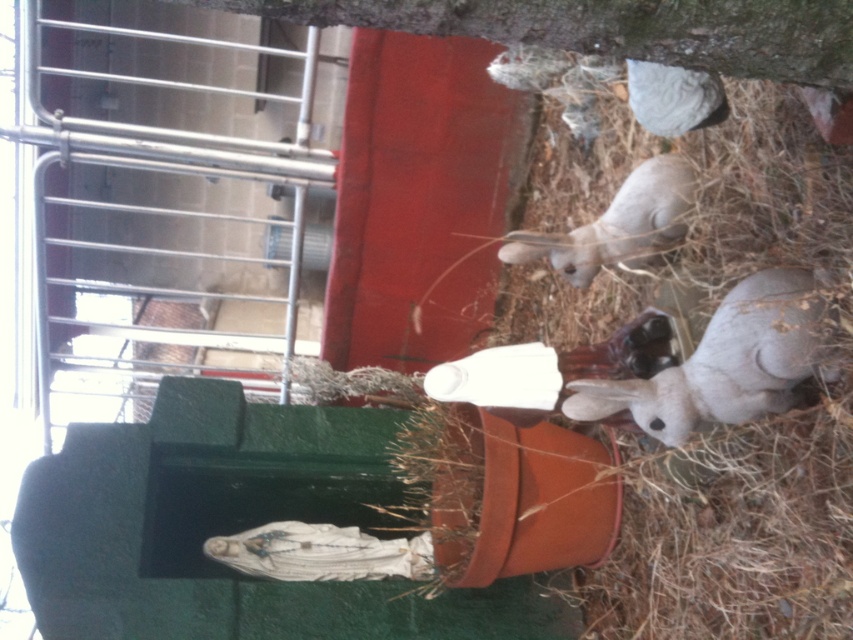
Question: Is gray matte rabbit at lower right closer to the viewer compared to fuzzy gray rabbit at lower right?

Choices:
 (A) yes
 (B) no

Answer: (A)

Question: Which point appears closest to the camera in this image?

Choices:
 (A) (677, 161)
 (B) (798, 378)

Answer: (B)

Question: Can you confirm if gray matte rabbit at lower right is positioned below fuzzy gray rabbit at lower right?

Choices:
 (A) no
 (B) yes

Answer: (B)

Question: Is gray matte rabbit at lower right closer to the viewer compared to fuzzy gray rabbit at lower right?

Choices:
 (A) yes
 (B) no

Answer: (A)